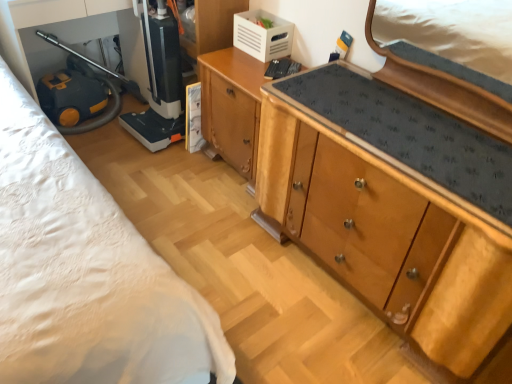
The height and width of the screenshot is (384, 512). In order to click on space that is in front of white plastic crate at upper center, the 1th appliance positioned from the right in this screenshot , I will do `click(253, 67)`.